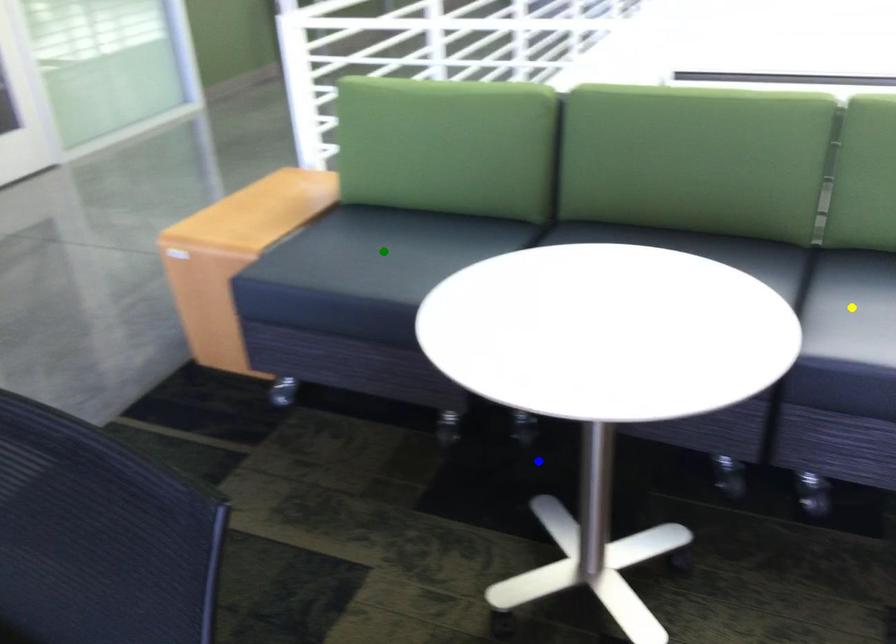
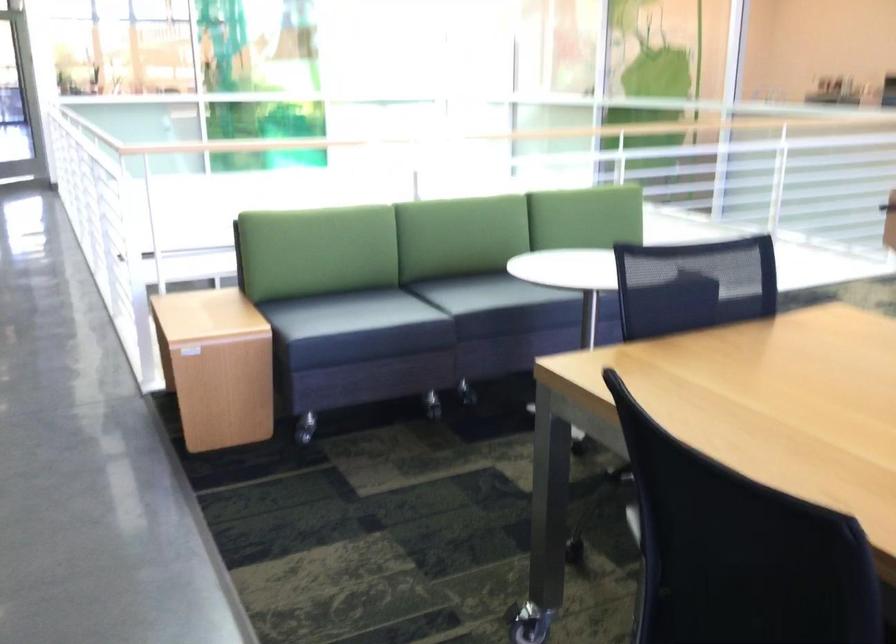
I am providing you with two images of the same scene from different viewpoints. Three points are marked in image1. Which point corresponds to a part or object that is occluded in image2?In image1, three points are marked. Which of them correspond to a part or object that is occluded in image2?Among the three points shown in image1, which one corresponds to a part or object that is no longer visible due to occlusion in image2?

Invisible in image2: yellow point.